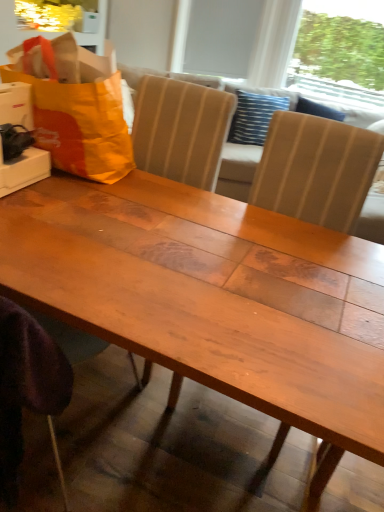
Question: Is orange fabric grocery bag at upper left aimed at white matte window screen at upper center, the 1th window screen in the left-to-right sequence?

Choices:
 (A) no
 (B) yes

Answer: (A)

Question: Is the position of orange fabric grocery bag at upper left more distant than that of white matte window screen at upper center, the 1th window screen in the left-to-right sequence?

Choices:
 (A) no
 (B) yes

Answer: (A)

Question: Does orange fabric grocery bag at upper left have a greater width compared to white matte window screen at upper center, which is the second window screen in right-to-left order?

Choices:
 (A) no
 (B) yes

Answer: (B)

Question: Is orange fabric grocery bag at upper left taller than white matte window screen at upper center, which is the second window screen in right-to-left order?

Choices:
 (A) yes
 (B) no

Answer: (B)

Question: Is white matte window screen at upper center, which is the second window screen in right-to-left order, at the back of orange fabric grocery bag at upper left?

Choices:
 (A) no
 (B) yes

Answer: (A)

Question: Is white matte window screen at upper center, which is the second window screen in right-to-left order, to the left or to the right of orange fabric grocery bag at upper left in the image?

Choices:
 (A) left
 (B) right

Answer: (B)

Question: From the image's perspective, is white matte window screen at upper center, the 1th window screen in the left-to-right sequence, located above or below orange fabric grocery bag at upper left?

Choices:
 (A) below
 (B) above

Answer: (B)

Question: In terms of width, does white matte window screen at upper center, which is the second window screen in right-to-left order, look wider or thinner when compared to orange fabric grocery bag at upper left?

Choices:
 (A) wide
 (B) thin

Answer: (B)

Question: In the image, is white matte window screen at upper center, which is the second window screen in right-to-left order, positioned in front of or behind orange fabric grocery bag at upper left?

Choices:
 (A) front
 (B) behind

Answer: (B)

Question: Is wooden table at center to the left or to the right of transparent plastic window screen at upper right, which ranks as the first window screen in right-to-left order, in the image?

Choices:
 (A) right
 (B) left

Answer: (B)

Question: From a real-world perspective, is wooden table at center positioned above or below transparent plastic window screen at upper right, which is counted as the 2th window screen, starting from the left?

Choices:
 (A) above
 (B) below

Answer: (B)

Question: Is wooden table at center bigger or smaller than transparent plastic window screen at upper right, which is counted as the 2th window screen, starting from the left?

Choices:
 (A) small
 (B) big

Answer: (A)

Question: From the image's perspective, is wooden table at center located above or below transparent plastic window screen at upper right, which ranks as the first window screen in right-to-left order?

Choices:
 (A) above
 (B) below

Answer: (B)

Question: From a real-world perspective, is transparent plastic window screen at upper right, which ranks as the first window screen in right-to-left order, above or below white matte window screen at upper center, which is the second window screen in right-to-left order?

Choices:
 (A) below
 (B) above

Answer: (B)

Question: In the image, is transparent plastic window screen at upper right, which ranks as the first window screen in right-to-left order, on the left side or the right side of white matte window screen at upper center, the 1th window screen in the left-to-right sequence?

Choices:
 (A) right
 (B) left

Answer: (A)